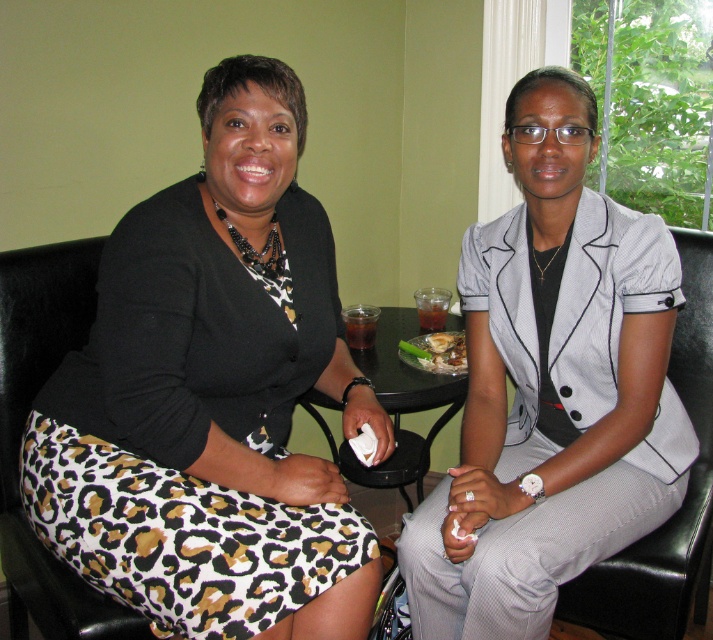
Question: Is gray fabric armchair at right behind black glass table at center?

Choices:
 (A) no
 (B) yes

Answer: (A)

Question: Which point is closer to the camera taking this photo?

Choices:
 (A) (265, 492)
 (B) (317, 420)

Answer: (A)

Question: Which object is farther from the camera taking this photo?

Choices:
 (A) gray textured suit at center
 (B) gray fabric armchair at right

Answer: (B)

Question: Which point is farther from the camera taking this photo?

Choices:
 (A) (456, 353)
 (B) (560, 273)

Answer: (A)

Question: Is gray textured suit at center further to the viewer compared to translucent glass cup at center?

Choices:
 (A) no
 (B) yes

Answer: (A)

Question: In this image, where is leopard print skirt at lower left located relative to gray fabric armchair at right?

Choices:
 (A) above
 (B) below

Answer: (B)